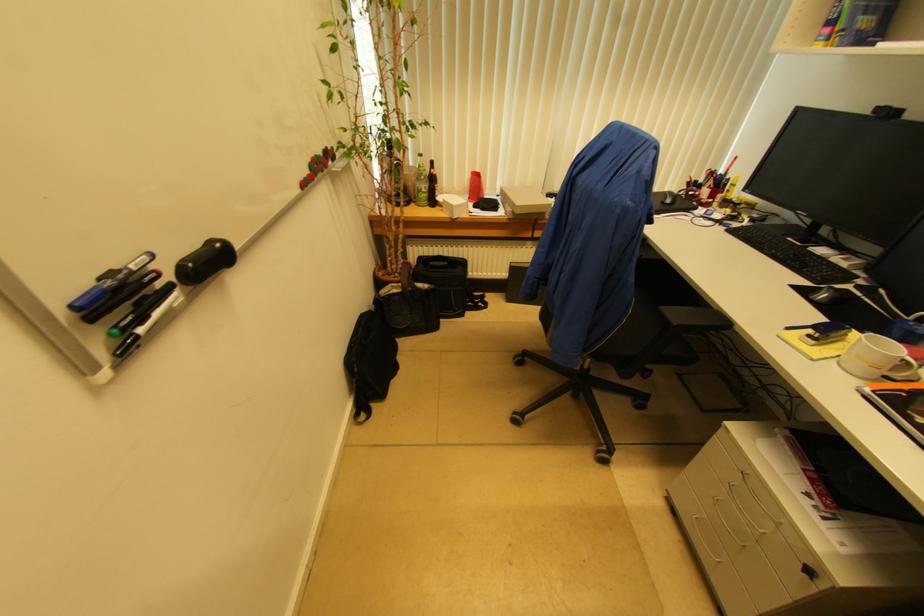
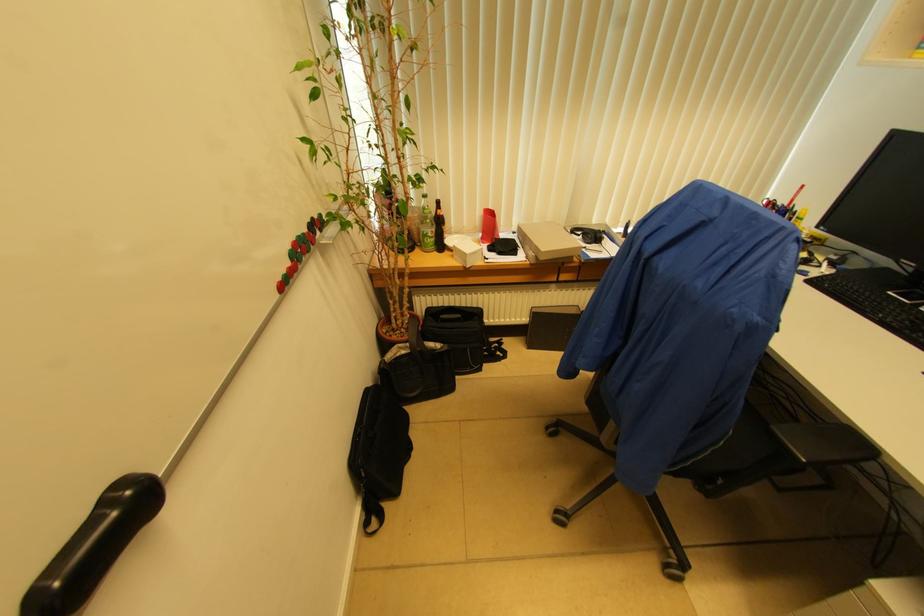
Where in the second image is the point corresponding to (484,309) from the first image?

(503, 358)